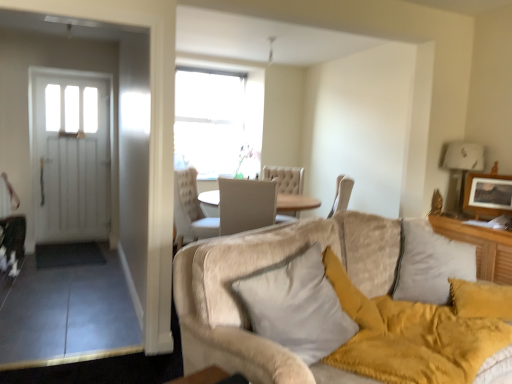
What do you see at coordinates (261, 269) in the screenshot?
I see `beige plush couch at lower right` at bounding box center [261, 269].

Where is `wooden picture frame at upper right`? This screenshot has height=384, width=512. wooden picture frame at upper right is located at coordinates [x=487, y=194].

Is white soft pillow at center wider than beige plush couch at lower right?

Incorrect, the width of white soft pillow at center does not surpass that of beige plush couch at lower right.

Is white soft pillow at center completely or partially outside of beige plush couch at lower right?

Yes.

Does white soft pillow at center turn towards beige plush couch at lower right?

No, white soft pillow at center is not aimed at beige plush couch at lower right.

From a real-world perspective, between white soft pillow at center and beige plush couch at lower right, who is vertically lower?

beige plush couch at lower right is physically lower.

Is beige plush couch at lower right bigger than wooden picture frame at upper right?

Indeed, beige plush couch at lower right has a larger size compared to wooden picture frame at upper right.

Is there a large distance between beige plush couch at lower right and wooden picture frame at upper right?

Absolutely, beige plush couch at lower right is distant from wooden picture frame at upper right.

Can you confirm if beige plush couch at lower right is taller than wooden picture frame at upper right?

No, beige plush couch at lower right is not taller than wooden picture frame at upper right.

From the image's perspective, between beige plush couch at lower right and wooden picture frame at upper right, who is located below?

From the image's view, beige plush couch at lower right is below.

Is wooden picture frame at upper right closer to the viewer compared to beige plush couch at lower right?

No, it is not.

Is wooden picture frame at upper right turned away from beige plush couch at lower right?

No.

Is point (490, 179) closer or farther from the camera than point (339, 248)?

Point (490, 179) is farther from the camera than point (339, 248).

Is wooden picture frame at upper right inside or outside of beige plush couch at lower right?

wooden picture frame at upper right exists outside the volume of beige plush couch at lower right.

Which is less distant, (496, 199) or (305, 284)?

The point (305, 284) is closer to the camera.

From a real-world perspective, is wooden picture frame at upper right positioned over white soft pillow at center based on gravity?

Yes, from a real-world perspective, wooden picture frame at upper right is above white soft pillow at center.

From the picture: Which object is positioned more to the left, wooden picture frame at upper right or white soft pillow at center?

Positioned to the left is white soft pillow at center.

Considering the relative sizes of beige plush couch at lower right and white soft pillow at center in the image provided, is beige plush couch at lower right wider than white soft pillow at center?

Yes.

From the picture: Considering the sizes of objects beige plush couch at lower right and white soft pillow at center in the image provided, who is bigger, beige plush couch at lower right or white soft pillow at center?

beige plush couch at lower right.

Considering the positions of objects beige plush couch at lower right and white soft pillow at center in the image provided, who is more to the right, beige plush couch at lower right or white soft pillow at center?

Positioned to the right is white soft pillow at center.

Which is correct: beige plush couch at lower right is inside white soft pillow at center, or outside of it?

beige plush couch at lower right is outside white soft pillow at center.

Between white soft pillow at center and wooden picture frame at upper right, which one appears on the left side from the viewer's perspective?

white soft pillow at center is more to the left.

Image resolution: width=512 pixels, height=384 pixels. Identify the location of picture frame on the right of white soft pillow at center. (487, 194).

Does point (250, 292) come farther from viewer compared to point (465, 193)?

No.

Find the location of `studio couch on the left of white soft pillow at center`. studio couch on the left of white soft pillow at center is located at coordinates (261, 269).

In order to click on picture frame on the right of the beige plush couch at lower right in this screenshot , I will do `click(487, 194)`.

Looking at the image, which one is located closer to beige plush couch at lower right, white soft pillow at center or wooden picture frame at upper right?

white soft pillow at center lies closer to beige plush couch at lower right than the other object.

Which object lies nearer to the anchor point wooden picture frame at upper right, white soft pillow at center or beige plush couch at lower right?

The object closer to wooden picture frame at upper right is beige plush couch at lower right.

When comparing their distances from white soft pillow at center, does wooden picture frame at upper right or beige plush couch at lower right seem closer?

beige plush couch at lower right is positioned closer to the anchor white soft pillow at center.

Considering their positions, is beige plush couch at lower right positioned further to wooden picture frame at upper right than white soft pillow at center?

The object further to wooden picture frame at upper right is white soft pillow at center.

From the image, which object appears to be farther from white soft pillow at center, beige plush couch at lower right or wooden picture frame at upper right?

Among the two, wooden picture frame at upper right is located further to white soft pillow at center.

Which object lies further to the anchor point beige plush couch at lower right, wooden picture frame at upper right or white soft pillow at center?

The object further to beige plush couch at lower right is wooden picture frame at upper right.

You are a GUI agent. You are given a task and a screenshot of the screen. Output one action in this format:
    pyautogui.click(x=<x>, y=<y>)
    Task: Click on the pillow between beige plush couch at lower right and wooden picture frame at upper right
    This screenshot has height=384, width=512.
    Given the screenshot: What is the action you would take?
    pyautogui.click(x=297, y=306)